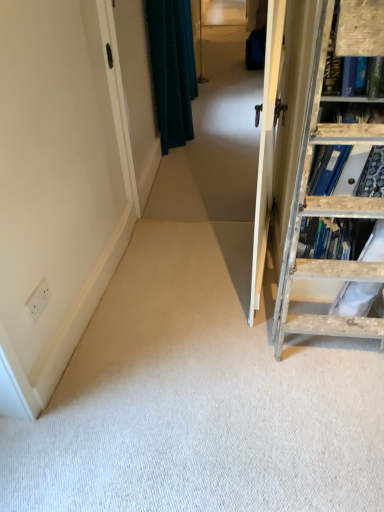
Question: Does teal velvet curtain at upper center come behind wooden ladder at right?

Choices:
 (A) yes
 (B) no

Answer: (A)

Question: Is teal velvet curtain at upper center in front of wooden ladder at right?

Choices:
 (A) no
 (B) yes

Answer: (A)

Question: Is wooden ladder at right at the back of teal velvet curtain at upper center?

Choices:
 (A) no
 (B) yes

Answer: (A)

Question: Considering the relative sizes of teal velvet curtain at upper center and wooden ladder at right in the image provided, is teal velvet curtain at upper center smaller than wooden ladder at right?

Choices:
 (A) no
 (B) yes

Answer: (A)

Question: Is teal velvet curtain at upper center to the left of wooden ladder at right from the viewer's perspective?

Choices:
 (A) yes
 (B) no

Answer: (A)

Question: From the image's perspective, is teal velvet curtain at upper center positioned above or below teal fabric curtain at upper left?

Choices:
 (A) above
 (B) below

Answer: (A)

Question: From a real-world perspective, is teal velvet curtain at upper center physically located above or below teal fabric curtain at upper left?

Choices:
 (A) above
 (B) below

Answer: (B)

Question: In terms of width, does teal velvet curtain at upper center look wider or thinner when compared to teal fabric curtain at upper left?

Choices:
 (A) wide
 (B) thin

Answer: (A)

Question: Considering the positions of teal velvet curtain at upper center and teal fabric curtain at upper left in the image, is teal velvet curtain at upper center taller or shorter than teal fabric curtain at upper left?

Choices:
 (A) short
 (B) tall

Answer: (A)

Question: In terms of height, does teal fabric curtain at upper left look taller or shorter compared to wooden ladder at right?

Choices:
 (A) short
 (B) tall

Answer: (B)

Question: Looking at the image, does teal fabric curtain at upper left seem bigger or smaller compared to wooden ladder at right?

Choices:
 (A) big
 (B) small

Answer: (B)

Question: Considering the relative positions of teal fabric curtain at upper left and wooden ladder at right in the image provided, is teal fabric curtain at upper left to the left or to the right of wooden ladder at right?

Choices:
 (A) left
 (B) right

Answer: (A)

Question: Relative to wooden ladder at right, is teal fabric curtain at upper left in front or behind?

Choices:
 (A) behind
 (B) front

Answer: (A)

Question: Visually, is wooden ladder at right positioned to the left or to the right of teal fabric curtain at upper left?

Choices:
 (A) right
 (B) left

Answer: (A)

Question: From a real-world perspective, relative to teal fabric curtain at upper left, is wooden ladder at right vertically above or below?

Choices:
 (A) above
 (B) below

Answer: (B)